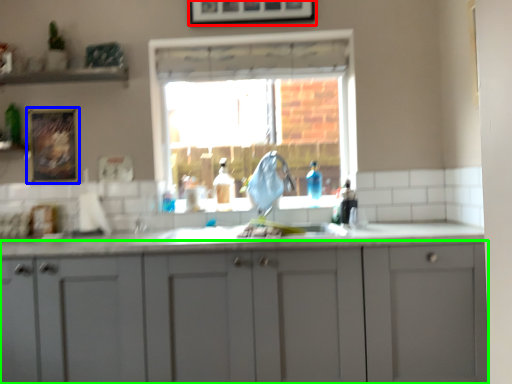
Question: Which object is positioned farthest from picture frame (highlighted by a red box)? Select from picture frame (highlighted by a blue box) and cabinetry (highlighted by a green box).

Choices:
 (A) picture frame
 (B) cabinetry

Answer: (B)